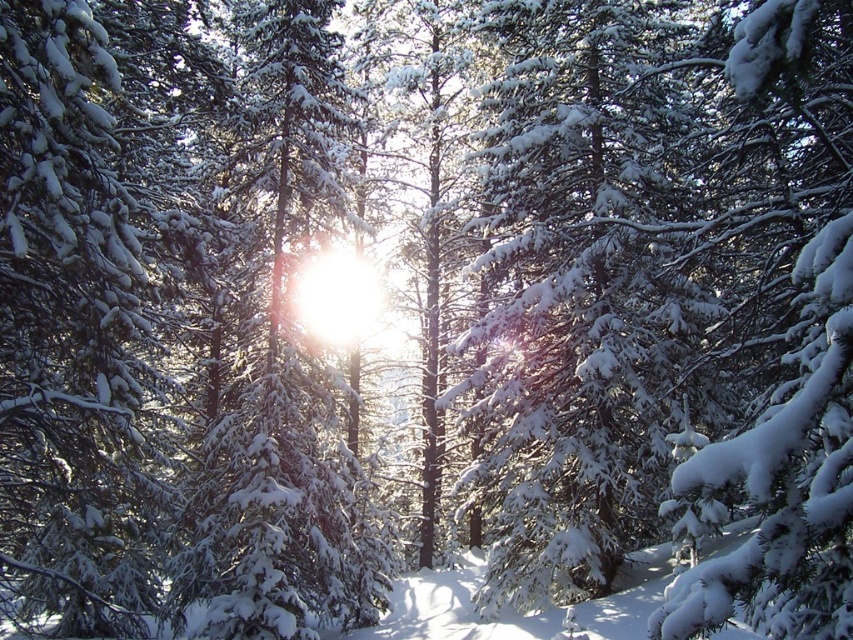
Question: Does green matte tree at left have a greater width compared to snow-covered pine tree at center?

Choices:
 (A) yes
 (B) no

Answer: (A)

Question: Does green matte tree at left appear under snow-covered pine tree at center?

Choices:
 (A) yes
 (B) no

Answer: (A)

Question: Can you confirm if green matte tree at left is thinner than snow-covered pine tree at center?

Choices:
 (A) no
 (B) yes

Answer: (A)

Question: Which of the following is the farthest from the observer?

Choices:
 (A) (113, 396)
 (B) (236, 490)

Answer: (B)